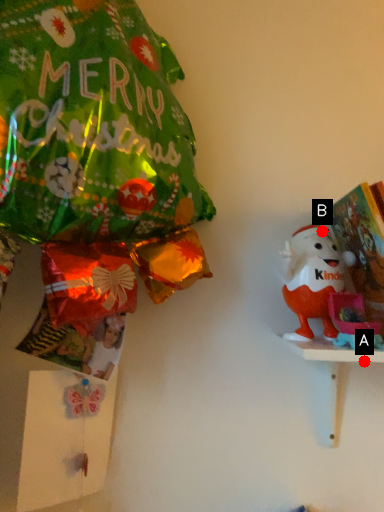
Question: Two points are circled on the image, labeled by A and B beside each circle. Which point is closer to the camera?

Choices:
 (A) A is closer
 (B) B is closer

Answer: (A)